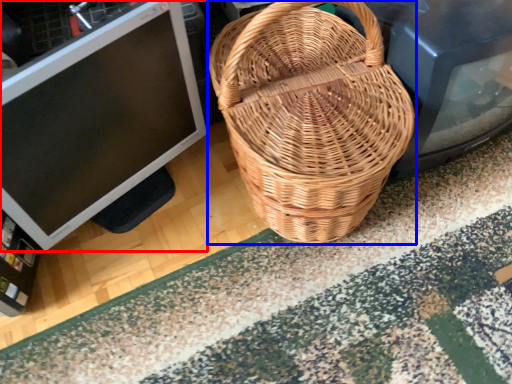
Question: Which point is further to the camera, computer monitor (highlighted by a red box) or picnic basket (highlighted by a blue box)?

Choices:
 (A) computer monitor
 (B) picnic basket

Answer: (A)